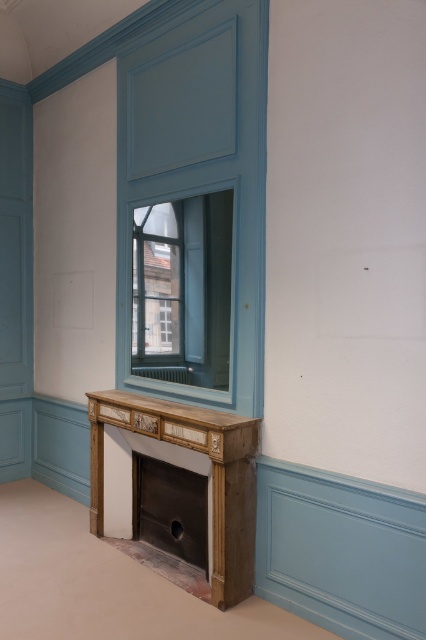
You are standing in the room and want to move from the point at coordinates point (x=169, y=426) to the point at coordinates point (x=143, y=472). Which direction should you move to get closer to your destination?

To move from point (x=169, y=426) to point (x=143, y=472), you should move towards the direction where the x and y coordinates increase, as point (x=143, y=472) is located to the right and slightly below the starting point.

You are designing a living room layout and need to place a tall plant that requires 1.2 meters of vertical space. Given the wooden fireplace at lower center and the metallic silver fireplace at lower center, which fireplace can accommodate the plant without blocking the view of the mirror above it?

The wooden fireplace at lower center has a greater height compared to the metallic silver fireplace at lower center, so the tall plant requiring 1.2 meters of vertical space can be placed on the wooden fireplace at lower center without blocking the view of the mirror above it.